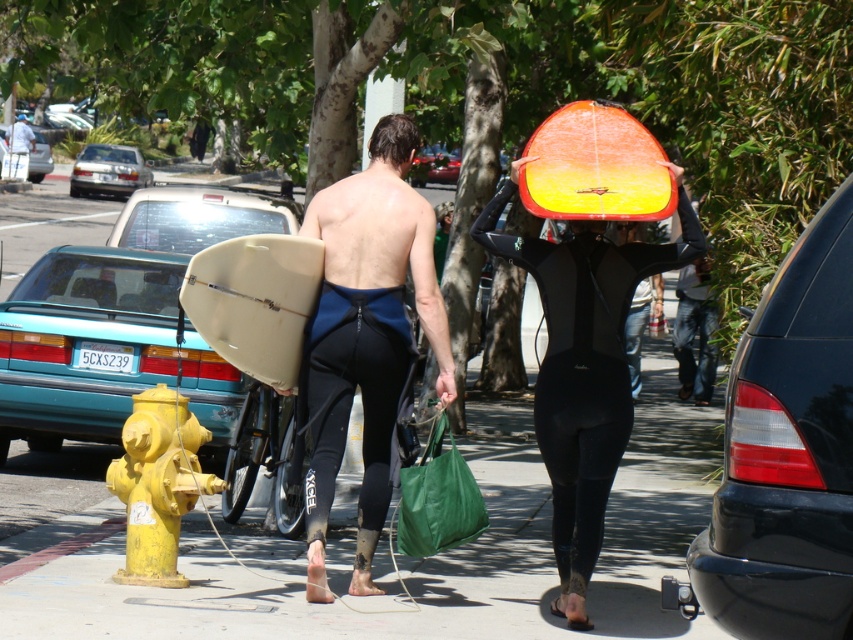
Can you confirm if beige matte surfboard at left is taller than yellow painted fire hydrant at lower left?

Incorrect, beige matte surfboard at left's height is not larger of yellow painted fire hydrant at lower left's.

Which is more to the right, beige matte surfboard at left or yellow painted fire hydrant at lower left?

Positioned to the right is beige matte surfboard at left.

Identify the location of beige matte surfboard at left. (254, 301).

Is point (422, 260) behind point (265, 326)?

Yes.

Can you confirm if matte black wetsuit at center is smaller than beige matte surfboard at left?

Incorrect, matte black wetsuit at center is not smaller in size than beige matte surfboard at left.

What do you see at coordinates (366, 336) in the screenshot? This screenshot has height=640, width=853. I see `matte black wetsuit at center` at bounding box center [366, 336].

Where is `matte black wetsuit at center`? The height and width of the screenshot is (640, 853). matte black wetsuit at center is located at coordinates (366, 336).

Between matte black wetsuit at center and teal matte car at center-left, which one appears on the right side from the viewer's perspective?

matte black wetsuit at center

Between matte black wetsuit at center and teal matte car at center-left, which one has more height?

matte black wetsuit at center

Between point (354, 387) and point (38, 134), which one is positioned in front?

Positioned in front is point (354, 387).

The image size is (853, 640). Find the location of `matte black wetsuit at center`. matte black wetsuit at center is located at coordinates (366, 336).